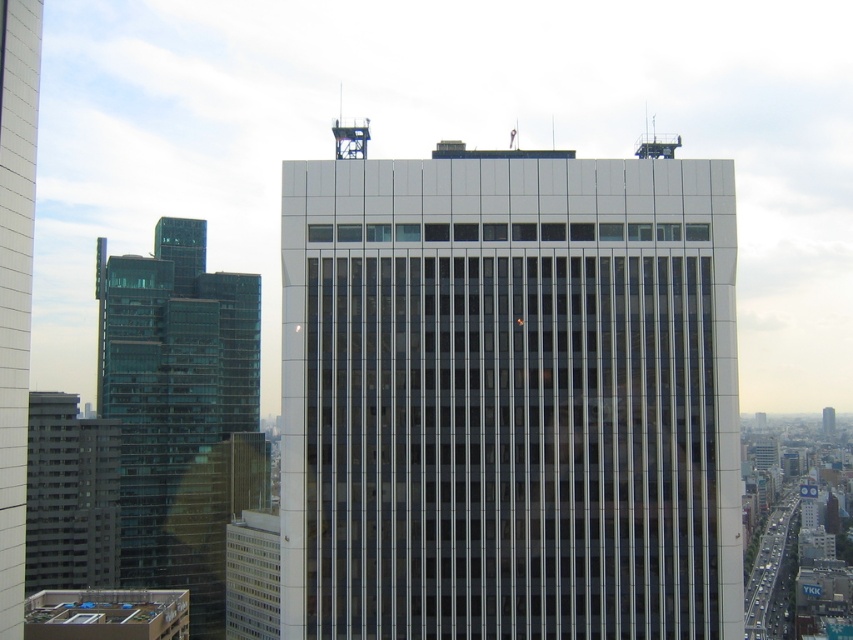
Question: Can you confirm if transparent glass building at left is positioned to the left of glassy reflective skyscraper at center?

Choices:
 (A) no
 (B) yes

Answer: (B)

Question: Does white glass building at center have a smaller size compared to transparent glass windows at lower left?

Choices:
 (A) no
 (B) yes

Answer: (A)

Question: Which point is farther from the camera taking this photo?

Choices:
 (A) (263, 612)
 (B) (242, 291)
 (C) (4, 556)
 (D) (578, 196)

Answer: (B)

Question: Estimate the real-world distances between objects in this image. Which object is closer to the glassy reflective skyscraper at center?

Choices:
 (A) transparent glass windows at lower left
 (B) white glass building at center

Answer: (B)

Question: Which point is farther to the camera?

Choices:
 (A) (0, 344)
 (B) (236, 552)

Answer: (B)

Question: From the image, what is the correct spatial relationship of white glass building at center in relation to glassy reflective skyscraper at center?

Choices:
 (A) below
 (B) above

Answer: (A)